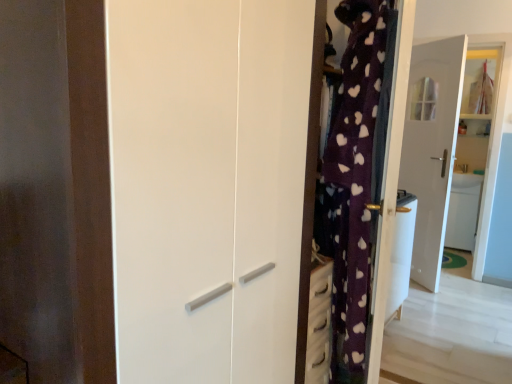
Question: Could you tell me if white glossy sink at right is turned towards white glossy wardrobe at center?

Choices:
 (A) yes
 (B) no

Answer: (A)

Question: From a real-world perspective, is white glossy sink at right over white glossy wardrobe at center?

Choices:
 (A) no
 (B) yes

Answer: (A)

Question: Considering the relative sizes of white glossy sink at right and white glossy wardrobe at center in the image provided, is white glossy sink at right wider than white glossy wardrobe at center?

Choices:
 (A) no
 (B) yes

Answer: (A)

Question: Is white glossy sink at right shorter than white glossy wardrobe at center?

Choices:
 (A) yes
 (B) no

Answer: (A)

Question: Is white glossy sink at right thinner than white glossy wardrobe at center?

Choices:
 (A) no
 (B) yes

Answer: (B)

Question: From the image's perspective, is white glossy sink at right located beneath white glossy wardrobe at center?

Choices:
 (A) yes
 (B) no

Answer: (B)

Question: Is white glossy wardrobe at center facing towards white glossy sink at right?

Choices:
 (A) no
 (B) yes

Answer: (A)

Question: Is white glossy wardrobe at center smaller than white glossy sink at right?

Choices:
 (A) yes
 (B) no

Answer: (B)

Question: Is white glossy wardrobe at center at the right side of white glossy sink at right?

Choices:
 (A) yes
 (B) no

Answer: (B)

Question: Considering the relative positions of white glossy wardrobe at center and white glossy sink at right in the image provided, is white glossy wardrobe at center behind white glossy sink at right?

Choices:
 (A) yes
 (B) no

Answer: (B)

Question: From a real-world perspective, does white glossy wardrobe at center stand above white glossy sink at right?

Choices:
 (A) yes
 (B) no

Answer: (A)

Question: Is white glossy wardrobe at center closer to the viewer compared to white glossy sink at right?

Choices:
 (A) no
 (B) yes

Answer: (B)

Question: Is white glossy door at center positioned in front of white glossy wardrobe at center?

Choices:
 (A) no
 (B) yes

Answer: (A)